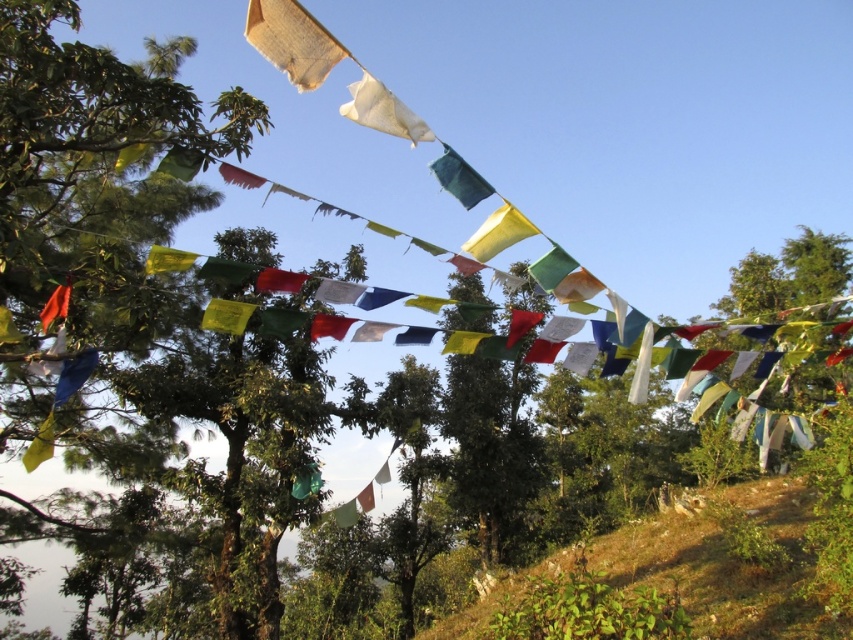
You are standing at the point labeled point at (525, 227). You want to walk to the nearest flag. How far will you have to walk?

The distance between you and the nearest flag is 3.00 meters.

You are a photographer trying to capture the tallest flag in the scene. You see the teal fabric flag at upper center and the orange fabric flag at left. Which flag should you focus on to get the tallest one?

The teal fabric flag at upper center is taller than the orange fabric flag at left, so you should focus on the teal fabric flag at upper center to capture the tallest one.

You are standing in front of the prayer flags and notice a specific point in the scene. What object is located at the coordinates point (383, 112)?

The white fabric flag at upper center is located at point (383, 112).